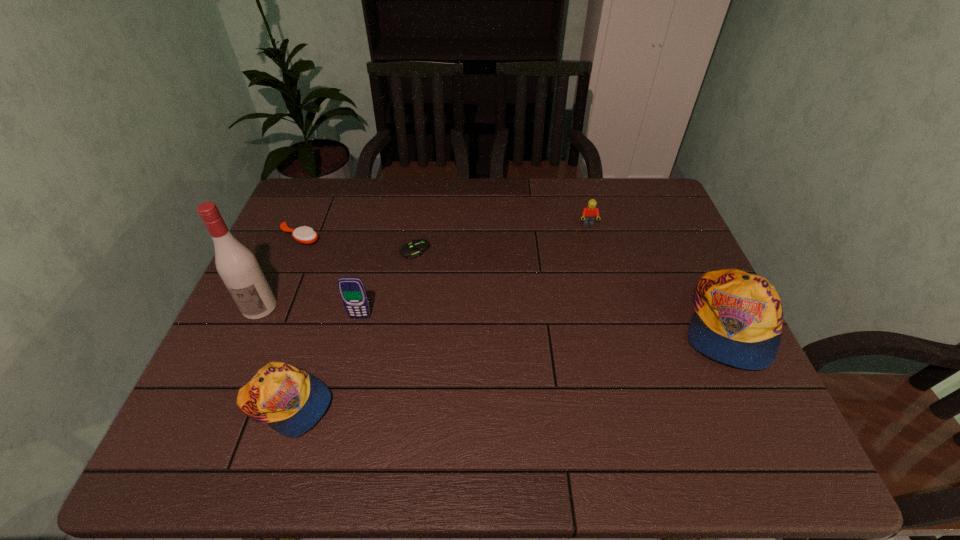
The image size is (960, 540). Find the location of `vacant area that lies between the cellular telephone and the sixth tallest object`. vacant area that lies between the cellular telephone and the sixth tallest object is located at coordinates (330, 277).

Where is `empty space between the alcohol and the cellular telephone`? The width and height of the screenshot is (960, 540). empty space between the alcohol and the cellular telephone is located at coordinates click(x=310, y=312).

Locate an element on the screen. The image size is (960, 540). vacant area between the rightmost object and the second object from right to left is located at coordinates (658, 274).

At what (x,y) coordinates should I click in order to perform the action: click on vacant space in between the tallest object and the rightmost object. Please return your answer as a coordinate pair (x, y). This screenshot has width=960, height=540. Looking at the image, I should click on (493, 315).

In order to click on vacant space in between the hairbrush and the Lego in this screenshot , I will do `click(444, 232)`.

Image resolution: width=960 pixels, height=540 pixels. In order to click on vacant region between the shorter cap and the cellular telephone in this screenshot , I will do `click(323, 360)`.

Locate an element on the screen. free spot between the alcohol and the second object from right to left is located at coordinates (424, 266).

Identify the location of free area in between the right cap and the cellular telephone. The image size is (960, 540). (543, 320).

Where is `free spot between the alcohol and the Lego`? Image resolution: width=960 pixels, height=540 pixels. free spot between the alcohol and the Lego is located at coordinates point(424,266).

You are a GUI agent. You are given a task and a screenshot of the screen. Output one action in this format:
    pyautogui.click(x=<x>, y=<y>)
    Task: Click on the second closest object to the second shortest object
    Image resolution: width=960 pixels, height=540 pixels.
    Given the screenshot: What is the action you would take?
    pyautogui.click(x=417, y=247)